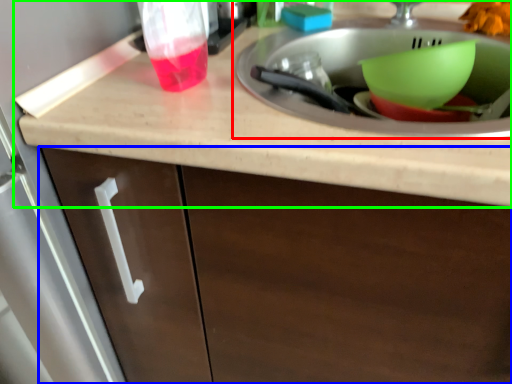
Question: Estimate the real-world distances between objects in this image. Which object is farther from sink (highlighted by a red box), cabinetry (highlighted by a blue box) or countertop (highlighted by a green box)?

Choices:
 (A) cabinetry
 (B) countertop

Answer: (A)